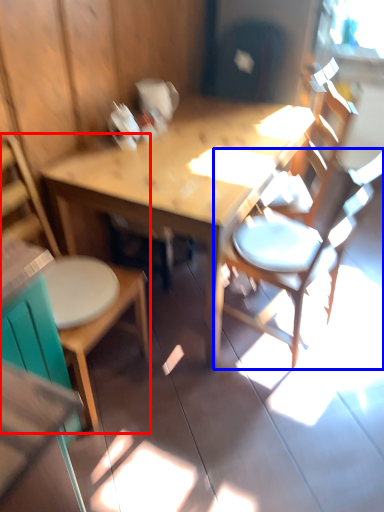
Question: Which object appears farthest to the camera in this image, chair (highlighted by a red box) or chair (highlighted by a blue box)?

Choices:
 (A) chair
 (B) chair

Answer: (B)